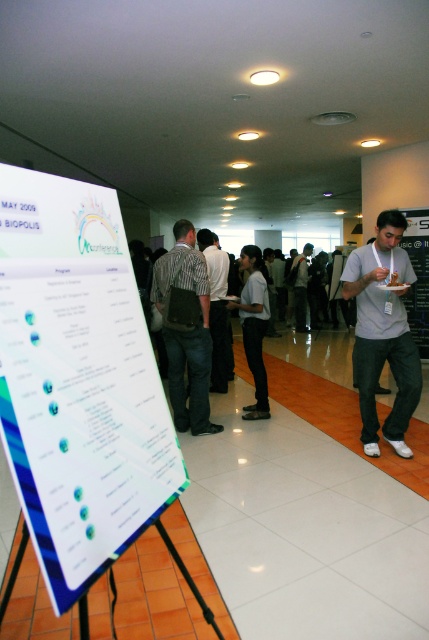
Who is positioned more to the left, gray matte t-shirt at right or matte white poster at center?

gray matte t-shirt at right

Based on the photo, is gray matte t-shirt at right above matte white poster at center?

Incorrect, gray matte t-shirt at right is not positioned above matte white poster at center.

Who is more distant from viewer, (393, 316) or (402, 241)?

Positioned behind is point (402, 241).

You are a GUI agent. You are given a task and a screenshot of the screen. Output one action in this format:
    pyautogui.click(x=<x>, y=<y>)
    Task: Click on the gray matte t-shirt at right
    This screenshot has height=640, width=429.
    Given the screenshot: What is the action you would take?
    pyautogui.click(x=383, y=330)

Can you confirm if striped fabric shirt at center is positioned to the right of dark gray shirt at center?

Incorrect, striped fabric shirt at center is not on the right side of dark gray shirt at center.

Can you confirm if striped fabric shirt at center is positioned to the left of dark gray shirt at center?

Correct, you'll find striped fabric shirt at center to the left of dark gray shirt at center.

Is point (166, 296) positioned before point (308, 248)?

Yes, it is in front of point (308, 248).

Where is `striped fabric shirt at center`? striped fabric shirt at center is located at coordinates (186, 328).

Between point (201, 369) and point (417, 332), which one is positioned in front?

Point (201, 369)

Is striped fabric shirt at center smaller than matte white poster at center?

Actually, striped fabric shirt at center might be larger than matte white poster at center.

At what (x,y) coordinates should I click in order to perform the action: click on striped fabric shirt at center. Please return your answer as a coordinate pair (x, y). Looking at the image, I should click on (186, 328).